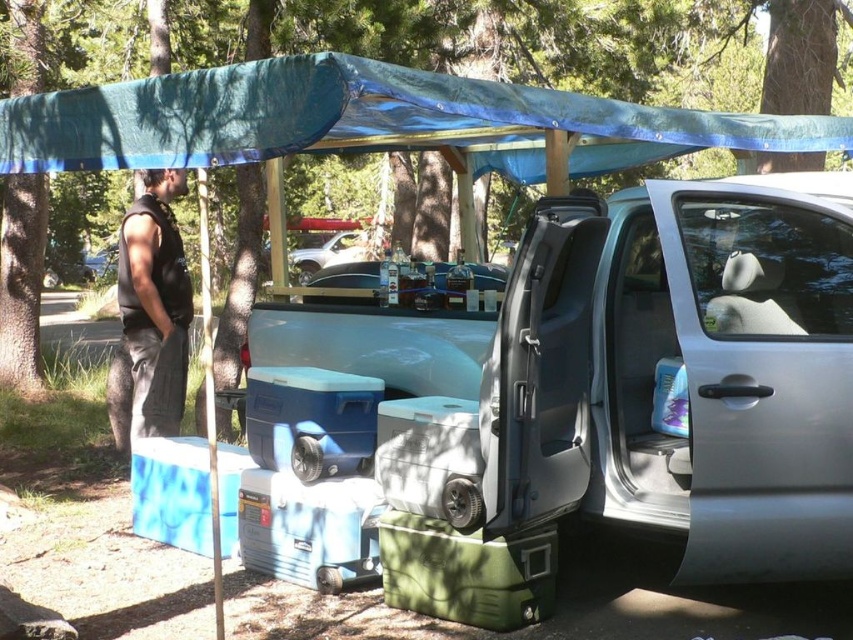
You are planning to park your car next to the satin silver minivan at center and the black sleeveless shirt at left. Which vehicle will require more space in width?

The satin silver minivan at center might be wider than the black sleeveless shirt at left, so it would require more space in width.

You are planning to park your car in the parking lot near the satin silver minivan at center. The parking spot is located at point 0.583,0.855. Can you safely park your car there?

The satin silver minivan at center is already parked at point (728, 372), so you cannot park your car there safely.